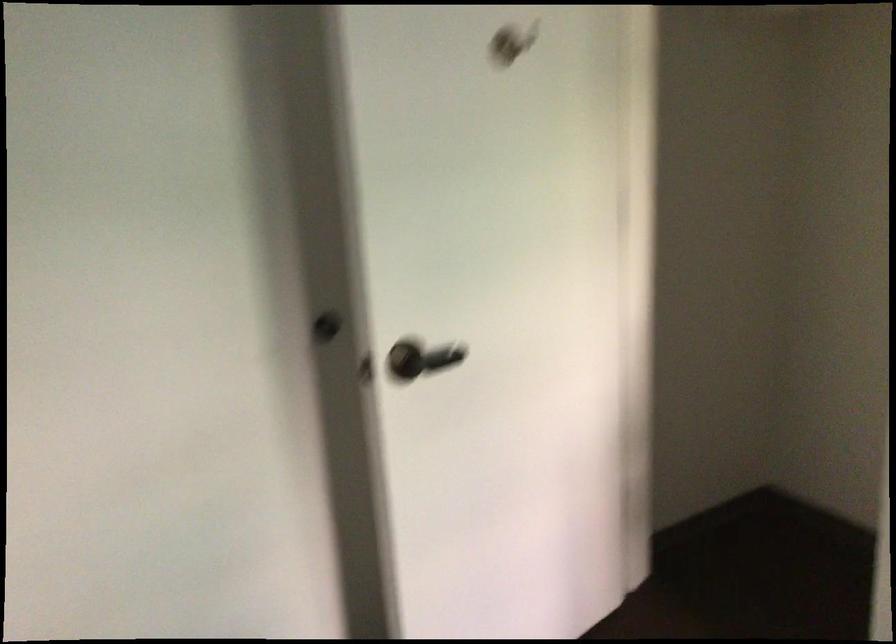
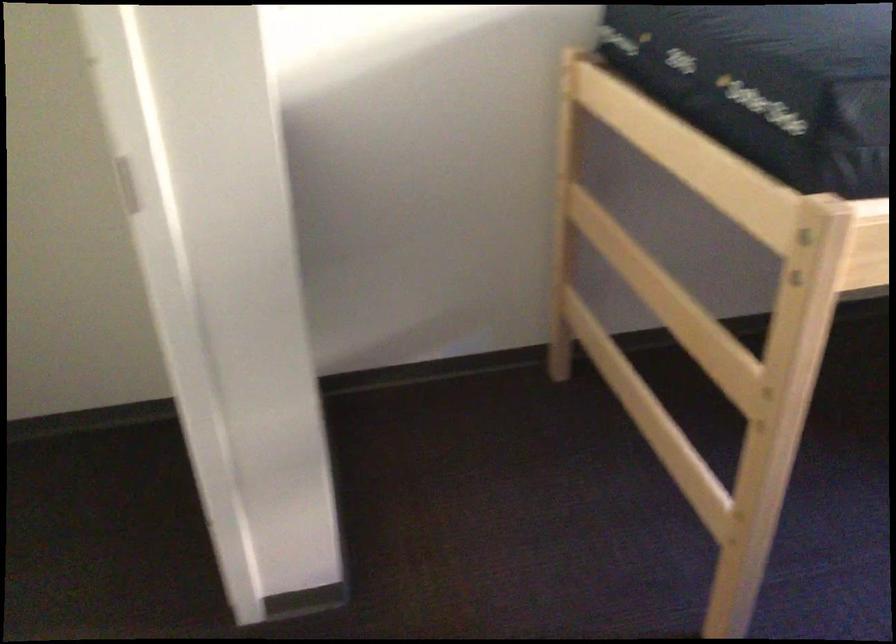
How did the camera likely rotate?

The rotation direction of the camera is right-down.